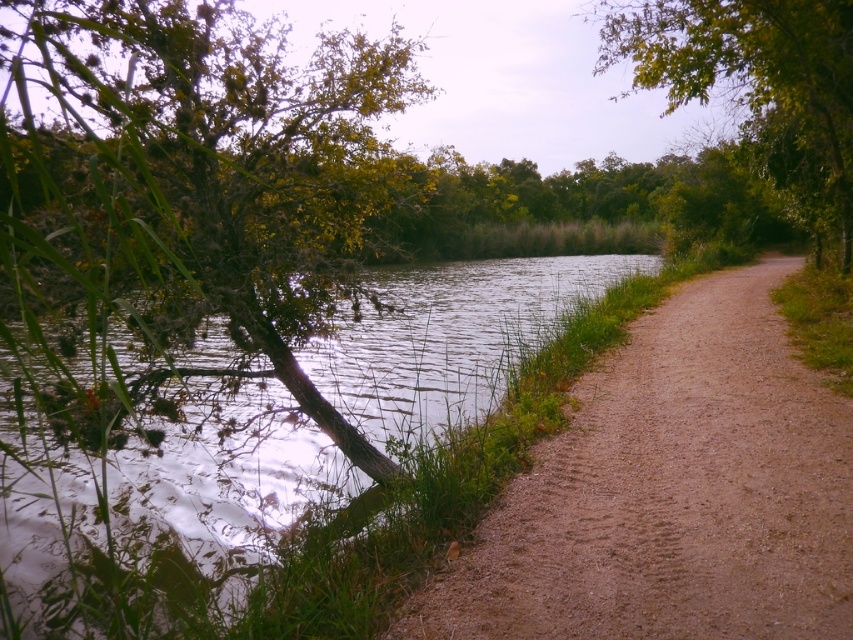
You are standing at the point with coordinates point (619, 394) and want to walk towards the point (10, 236). Based on the scene description, will you be moving towards the water or away from it?

Since point (10, 236) is in front of point (619, 394), moving towards it would mean walking towards the water as the path curves slightly to the right and the water is along the edge of the path.